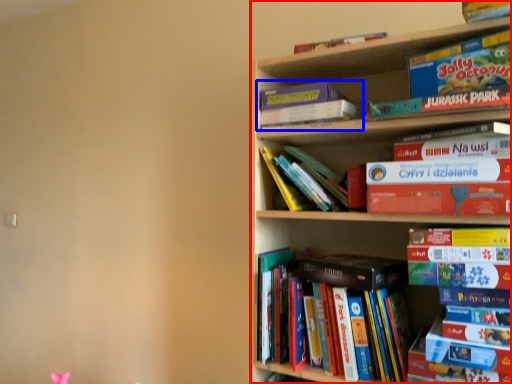
Question: Which of the following is the closest to the observer, bookcase (highlighted by a red box) or book (highlighted by a blue box)?

Choices:
 (A) bookcase
 (B) book

Answer: (A)